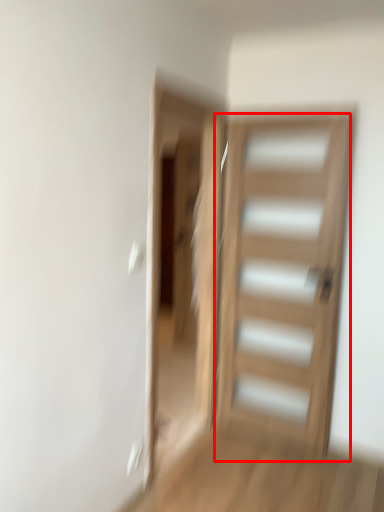
Question: From the image's perspective, considering the relative positions of door (annotated by the red box) and screen door in the image provided, where is door (annotated by the red box) located with respect to the staircase?

Choices:
 (A) above
 (B) below

Answer: (B)